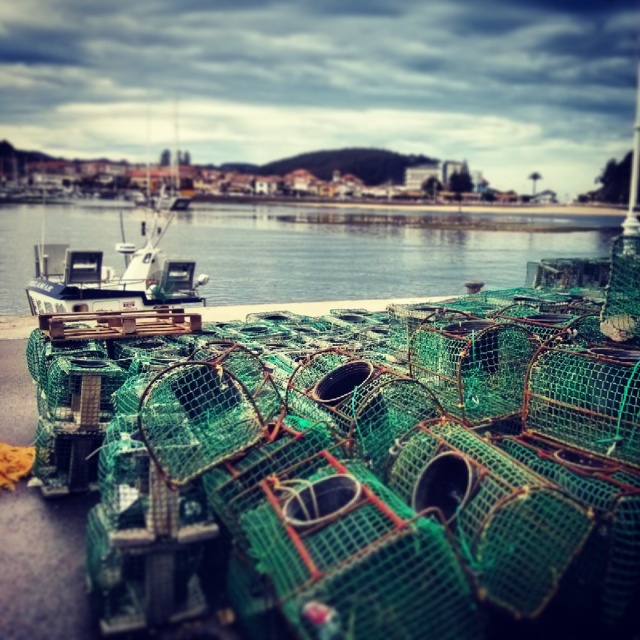
Question: Is clear blue water at center behind white plastic boat at center?

Choices:
 (A) yes
 (B) no

Answer: (A)

Question: Among these points, which one is farthest from the camera?

Choices:
 (A) (20, 227)
 (B) (109, 301)

Answer: (A)

Question: Does clear blue water at center have a smaller size compared to white plastic boat at center?

Choices:
 (A) yes
 (B) no

Answer: (B)

Question: Does clear blue water at center appear on the right side of white plastic boat at center?

Choices:
 (A) no
 (B) yes

Answer: (B)